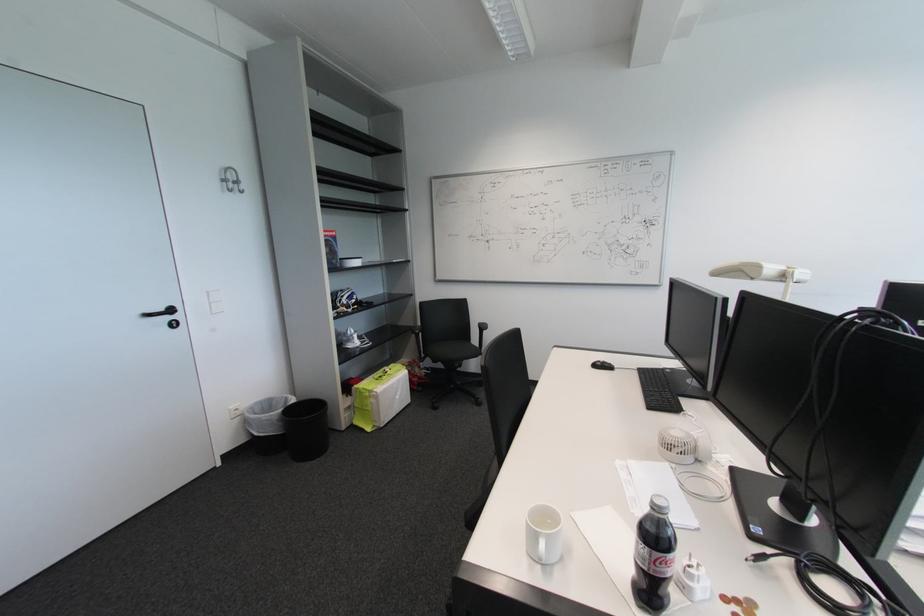
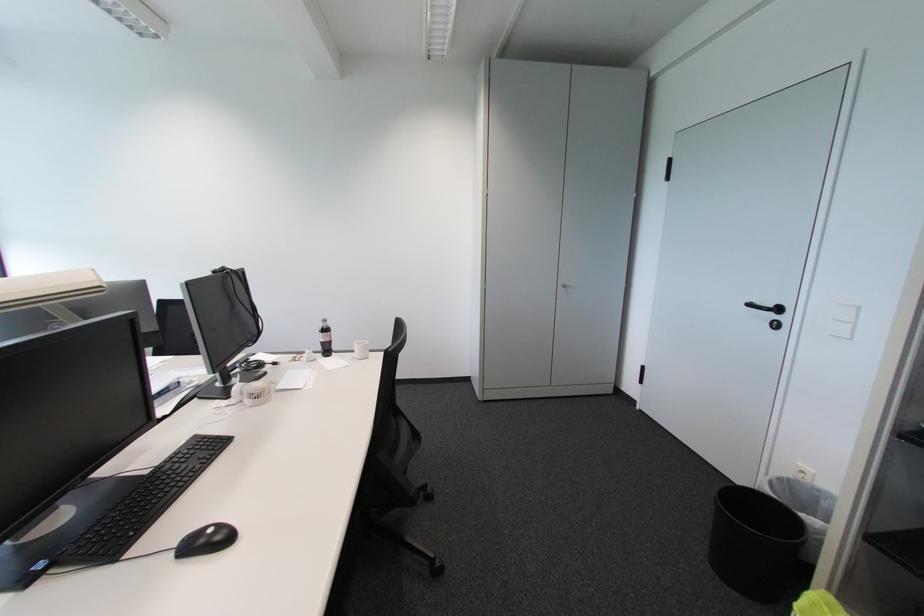
Where in the second image is the point corresponding to [324,461] from the first image?

(714, 565)